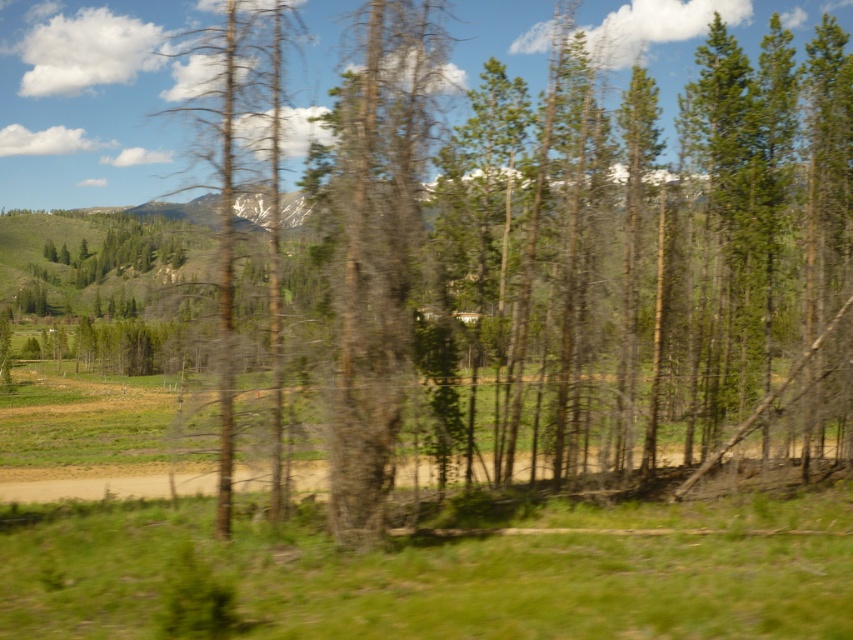
You are a park ranger assessing the forest health. You notice two trees at the center of the scene, a gray bark tree at center and a dead bark tree at center. Which tree takes up more space in the image?

The dead bark tree at center occupies more space than the gray bark tree at center.

You are a hiker trying to locate the gray bark tree at center and the brown dirt track at center in the forest scene. According to the image, which object is positioned to the right of the other?

The gray bark tree at center is to the right of the brown dirt track at center.

You are standing at the bottom left corner of the image. Which direction should you walk to reach the gray bark tree at center?

Since the gray bark tree at center is located at point coordinates of 0.392 on the x axis and 0.441 on the y axis, you should walk towards the center of the image to reach it.